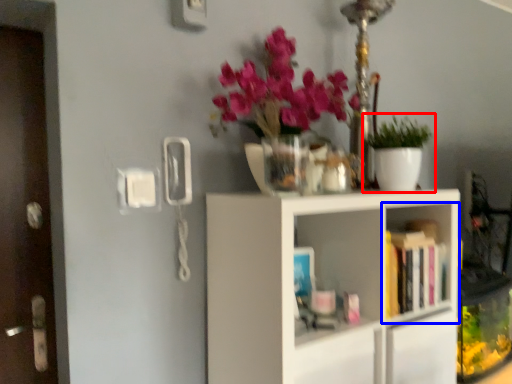
Question: Which object appears farthest to the camera in this image, houseplant (highlighted by a red box) or shelf (highlighted by a blue box)?

Choices:
 (A) houseplant
 (B) shelf

Answer: (A)